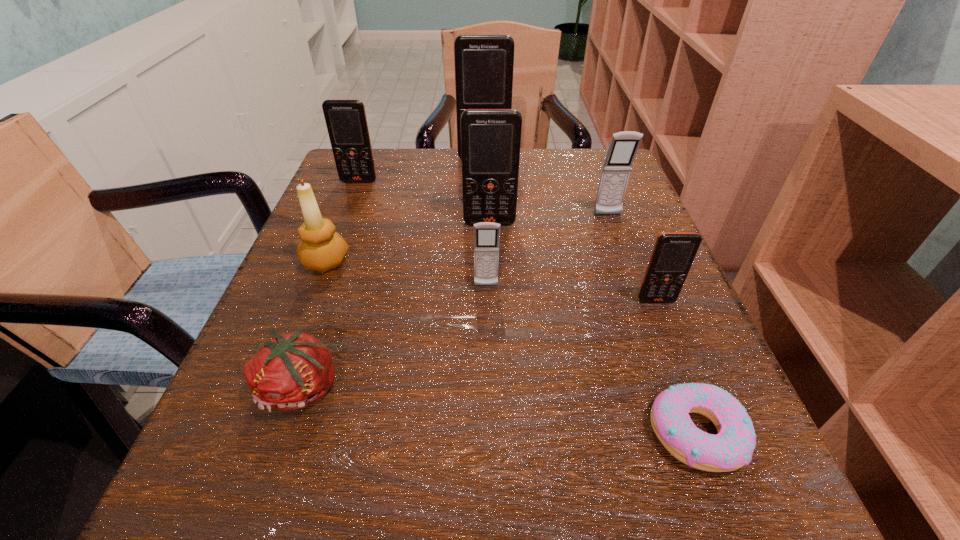
The width and height of the screenshot is (960, 540). Identify the location of free space between the fourth farthest object and the doughnut. (593, 328).

Where is `unoccupied position between the second smallest orange cellular telephone and the eighth shortest object`? Image resolution: width=960 pixels, height=540 pixels. unoccupied position between the second smallest orange cellular telephone and the eighth shortest object is located at coordinates tap(424, 202).

You are a GUI agent. You are given a task and a screenshot of the screen. Output one action in this format:
    pyautogui.click(x=<x>, y=<y>)
    Task: Click on the blank region between the fourth nearest cellular telephone and the third farthest orange cellular telephone
    
    Given the screenshot: What is the action you would take?
    pyautogui.click(x=549, y=219)

I want to click on empty space that is in between the doughnut and the second farthest orange cellular telephone, so coord(528,307).

Where is `free space between the nearer gray cellular telephone and the third nearest object`? This screenshot has height=540, width=960. free space between the nearer gray cellular telephone and the third nearest object is located at coordinates (571, 293).

At what (x,y) coordinates should I click in order to perform the action: click on vacant space that is in between the leftmost orange cellular telephone and the sixth nearest object. Please return your answer as a coordinate pair (x, y). The height and width of the screenshot is (540, 960). Looking at the image, I should click on (424, 202).

This screenshot has width=960, height=540. Identify the location of free space between the third farthest object and the sixth nearest object. (549, 219).

Find the location of a particular element. vacant area between the doughnut and the third nearest cellular telephone is located at coordinates tap(593, 328).

Image resolution: width=960 pixels, height=540 pixels. In order to click on free space that is in between the candle_holder and the farther gray cellular telephone in this screenshot , I will do `click(467, 238)`.

You are a GUI agent. You are given a task and a screenshot of the screen. Output one action in this format:
    pyautogui.click(x=<x>, y=<y>)
    Task: Click on the free space that is in between the third nearest orange cellular telephone and the farthest orange cellular telephone
    The image size is (960, 540).
    Given the screenshot: What is the action you would take?
    click(421, 170)